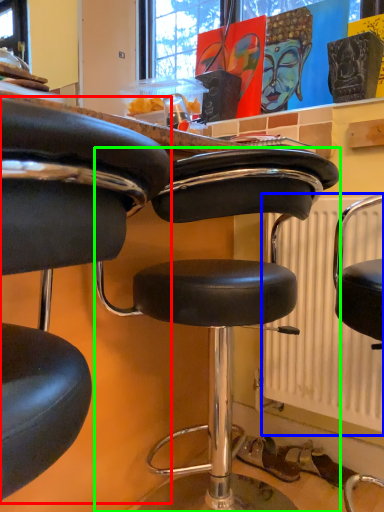
Question: Which is nearer to the chair (highlighted by a red box)? radiator (highlighted by a blue box) or chair (highlighted by a green box).

Choices:
 (A) radiator
 (B) chair

Answer: (B)